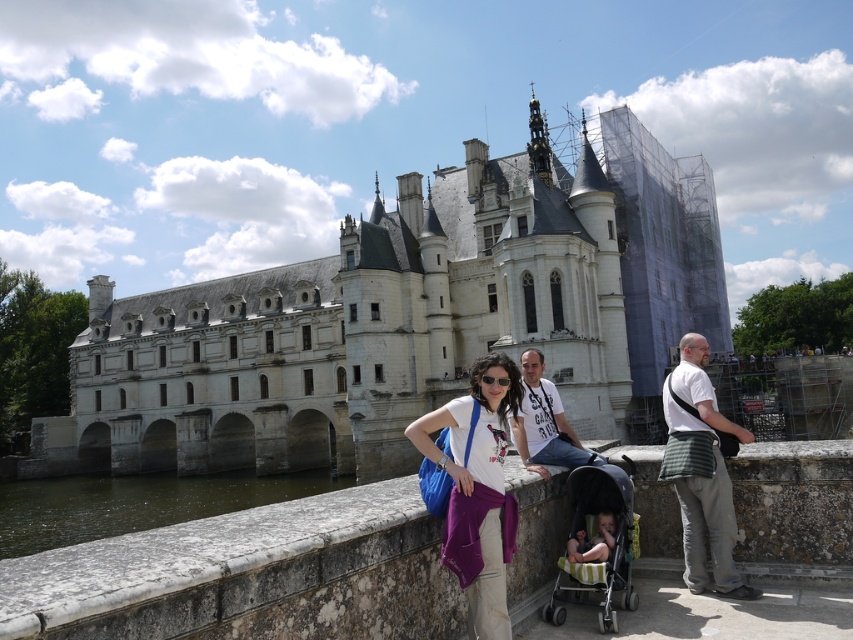
Question: Considering the real-world distances, which object is closest to the greenish stone waterway at lower left?

Choices:
 (A) white stone castle at center
 (B) purple fabric at center
 (C) striped fabric bag at right
 (D) white cotton t-shirt at center

Answer: (A)

Question: Does green striped fabric stroller at center come in front of white cotton t-shirt at center?

Choices:
 (A) no
 (B) yes

Answer: (B)

Question: Which object is positioned farthest from the green striped fabric stroller at center?

Choices:
 (A) striped fabric bag at right
 (B) greenish stone waterway at lower left
 (C) stone ledge at center

Answer: (B)

Question: Which of the following is the closest to the observer?

Choices:
 (A) [x=283, y=502]
 (B) [x=287, y=484]
 (C) [x=607, y=467]

Answer: (A)

Question: Can you confirm if purple fabric at center is smaller than green striped fabric stroller at center?

Choices:
 (A) yes
 (B) no

Answer: (B)

Question: Where is white stone castle at center located in relation to greenish stone waterway at lower left in the image?

Choices:
 (A) right
 (B) left

Answer: (A)